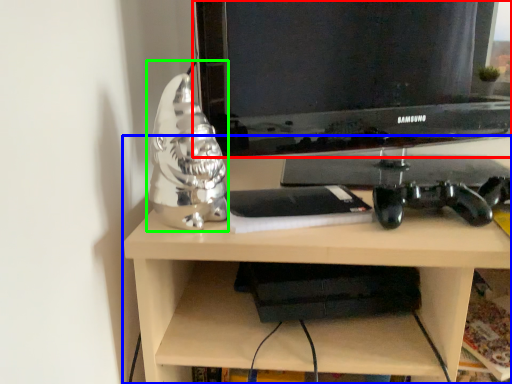
Question: Estimate the real-world distances between objects in this image. Which object is farther from television (highlighted by a red box), desk (highlighted by a blue box) or figurine (highlighted by a green box)?

Choices:
 (A) desk
 (B) figurine

Answer: (B)